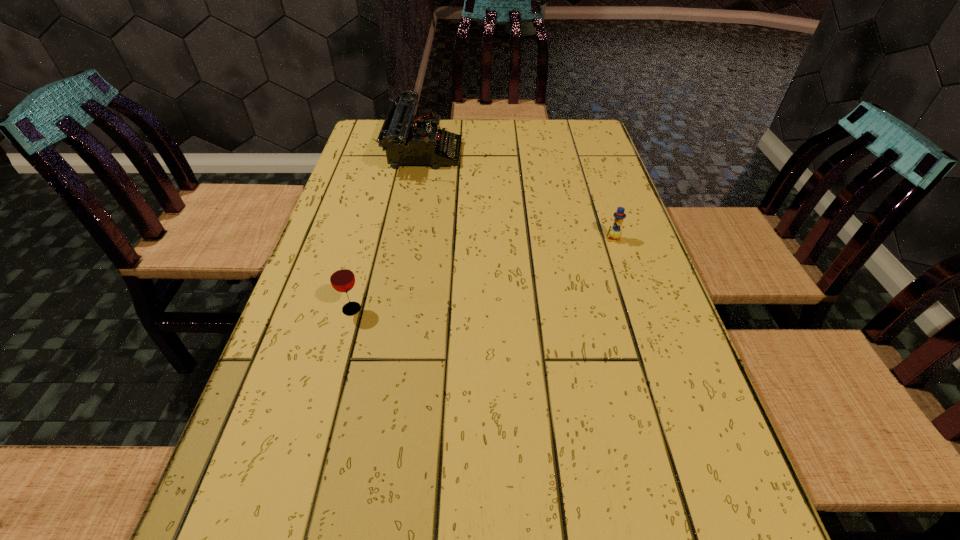
The height and width of the screenshot is (540, 960). What are the coordinates of `empty location between the rightmost object and the glass` in the screenshot? It's located at (482, 274).

Find the location of a particular element. empty location between the farthest object and the glass is located at coordinates (388, 231).

Identify the location of empty space that is in between the typewriter and the second shortest object. (388, 231).

This screenshot has height=540, width=960. Find the location of `empty space between the farthest object and the second shortest object`. empty space between the farthest object and the second shortest object is located at coordinates (388, 231).

The height and width of the screenshot is (540, 960). In order to click on vacant space in between the shortest object and the second shortest object in this screenshot , I will do `click(482, 274)`.

Locate an element on the screen. This screenshot has height=540, width=960. vacant area between the typewriter and the glass is located at coordinates (388, 231).

Find the location of a particular element. Image resolution: width=960 pixels, height=540 pixels. free area in between the duckling and the farthest object is located at coordinates (518, 195).

Locate an element on the screen. object that can be found as the closest to the second tallest object is located at coordinates (408, 139).

Locate which object ranks in proximity to the duckling. Please provide its 2D coordinates. Your answer should be formatted as a tuple, i.e. [(x, y)], where the tuple contains the x and y coordinates of a point satisfying the conditions above.

[(408, 139)]

Locate an element on the screen. vacant space that satisfies the following two spatial constraints: 1. on the keyboard of the typewriter; 2. on the front side of the nearest object is located at coordinates (396, 309).